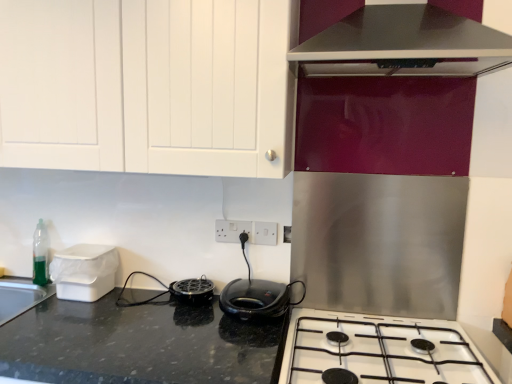
Question: Can you confirm if white plastic electric outlet at center, the second electric outlet in the left-to-right sequence, is thinner than white plastic container at left?

Choices:
 (A) yes
 (B) no

Answer: (A)

Question: Is white plastic electric outlet at center, the second electric outlet in the left-to-right sequence, oriented away from white plastic container at left?

Choices:
 (A) no
 (B) yes

Answer: (A)

Question: From a real-world perspective, is white plastic electric outlet at center, which ranks as the first electric outlet in right-to-left order, located higher than white plastic container at left?

Choices:
 (A) no
 (B) yes

Answer: (B)

Question: Does white plastic electric outlet at center, the second electric outlet in the left-to-right sequence, have a greater width compared to white plastic container at left?

Choices:
 (A) no
 (B) yes

Answer: (A)

Question: Can you confirm if white plastic electric outlet at center, which ranks as the first electric outlet in right-to-left order, is smaller than white plastic container at left?

Choices:
 (A) yes
 (B) no

Answer: (A)

Question: Is white plastic electric outlet at center, the second electric outlet in the left-to-right sequence, behind white plastic container at left?

Choices:
 (A) no
 (B) yes

Answer: (B)

Question: Is white plastic container at left beside white glossy gas stove at lower center?

Choices:
 (A) no
 (B) yes

Answer: (A)

Question: Can you confirm if white plastic container at left is positioned to the left of white glossy gas stove at lower center?

Choices:
 (A) no
 (B) yes

Answer: (B)

Question: Considering the relative sizes of white plastic container at left and white glossy gas stove at lower center in the image provided, is white plastic container at left thinner than white glossy gas stove at lower center?

Choices:
 (A) no
 (B) yes

Answer: (B)

Question: Does white plastic container at left have a greater width compared to white glossy gas stove at lower center?

Choices:
 (A) yes
 (B) no

Answer: (B)

Question: Is white plastic container at left outside white glossy gas stove at lower center?

Choices:
 (A) no
 (B) yes

Answer: (B)

Question: Is white plastic container at left behind white glossy gas stove at lower center?

Choices:
 (A) no
 (B) yes

Answer: (B)

Question: Can you see white plastic electric outlet at center, the 2th electric outlet when ordered from right to left, touching white glossy gas stove at lower center?

Choices:
 (A) no
 (B) yes

Answer: (A)